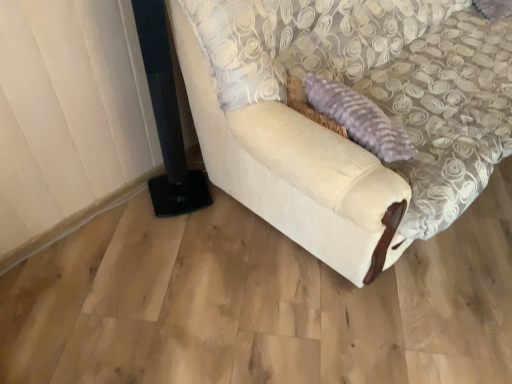
Describe the element at coordinates (339, 135) in the screenshot. I see `white fabric couch at center` at that location.

Locate an element on the screen. white fabric couch at center is located at coordinates (339, 135).

I want to click on white fabric couch at center, so click(x=339, y=135).